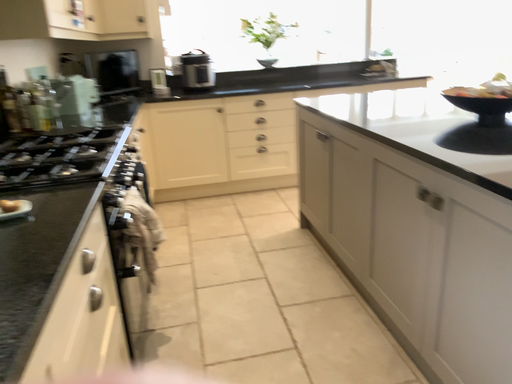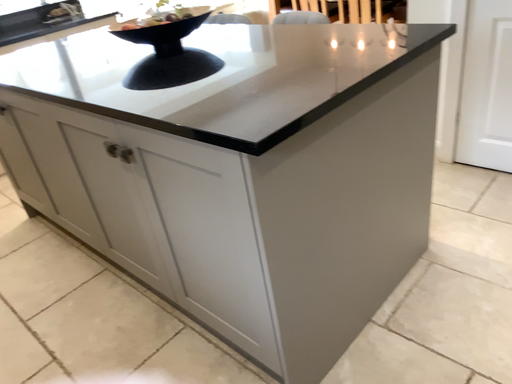
Question: Which way did the camera rotate in the video?

Choices:
 (A) rotated left
 (B) rotated right

Answer: (B)